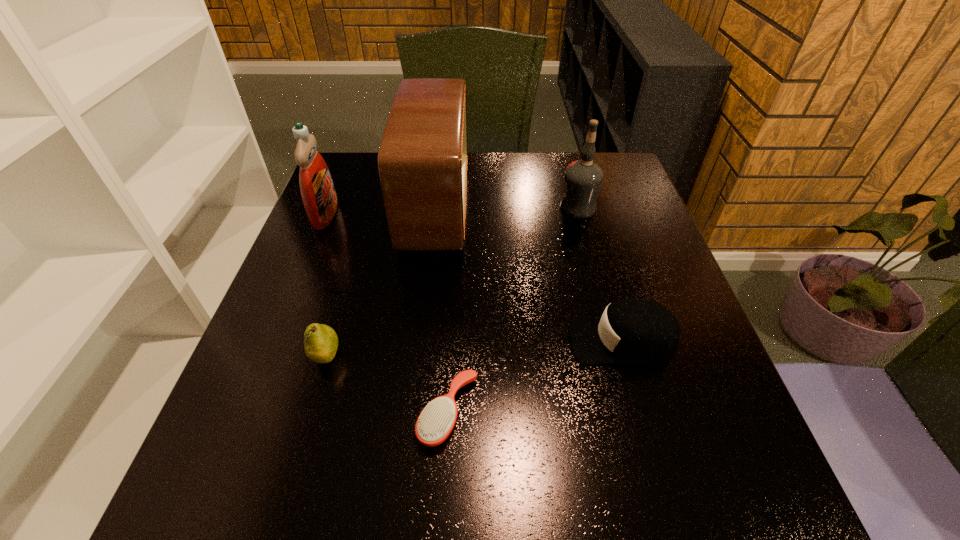
Find the location of a particular element. The height and width of the screenshot is (540, 960). the closest object to the cap is located at coordinates (436, 421).

Locate an element on the screen. The width and height of the screenshot is (960, 540). free space in the image that satisfies the following two spatial constraints: 1. on the front surface of the leftmost object; 2. on the left side of the hairbrush is located at coordinates (245, 413).

The image size is (960, 540). In order to click on free space that satisfies the following two spatial constraints: 1. on the front-facing side of the radio receiver; 2. on the front side of the fifth object from right to left in this screenshot , I will do `click(419, 357)`.

The image size is (960, 540). I want to click on free space in the image that satisfies the following two spatial constraints: 1. on the front-facing side of the shortest object; 2. on the right side of the radio receiver, so pos(412,413).

Find the location of a particular element. free space that satisfies the following two spatial constraints: 1. on the front surface of the shortest object; 2. on the left side of the detergent is located at coordinates (245, 413).

You are a GUI agent. You are given a task and a screenshot of the screen. Output one action in this format:
    pyautogui.click(x=<x>, y=<y>)
    Task: Click on the free region that satisfies the following two spatial constraints: 1. on the back side of the shortest object; 2. on the front-facing side of the radio receiver
    The width and height of the screenshot is (960, 540).
    Given the screenshot: What is the action you would take?
    pyautogui.click(x=459, y=208)

The height and width of the screenshot is (540, 960). In order to click on free point that satisfies the following two spatial constraints: 1. on the front-facing side of the nearest object; 2. on the right side of the radio receiver in this screenshot , I will do `click(412, 413)`.

In order to click on free spot that satisfies the following two spatial constraints: 1. on the front surface of the detergent; 2. on the right side of the fifth object from right to left in this screenshot , I will do `click(267, 357)`.

Identify the location of free space that satisfies the following two spatial constraints: 1. on the back side of the shortest object; 2. on the front surface of the leftmost object. (459, 214).

The width and height of the screenshot is (960, 540). I want to click on vacant space that satisfies the following two spatial constraints: 1. on the front surface of the nearest object; 2. on the left side of the detergent, so click(245, 413).